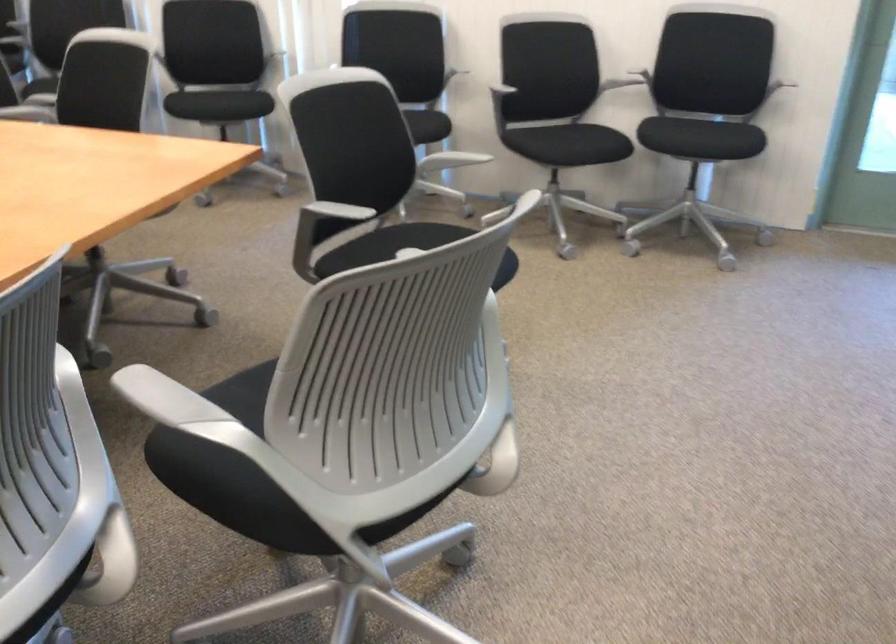
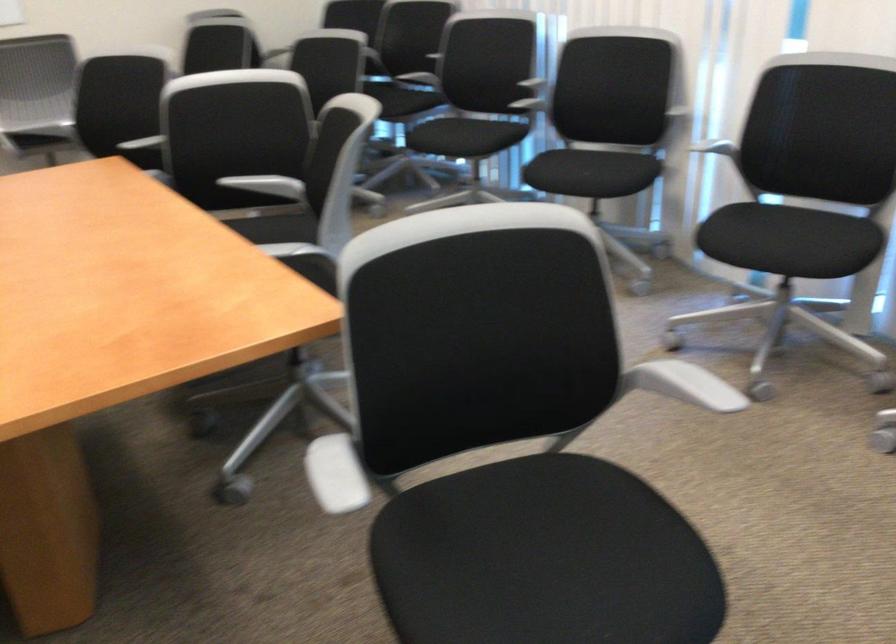
In the second image, find the point that corresponds to pixel 460 156 in the first image.

(682, 384)